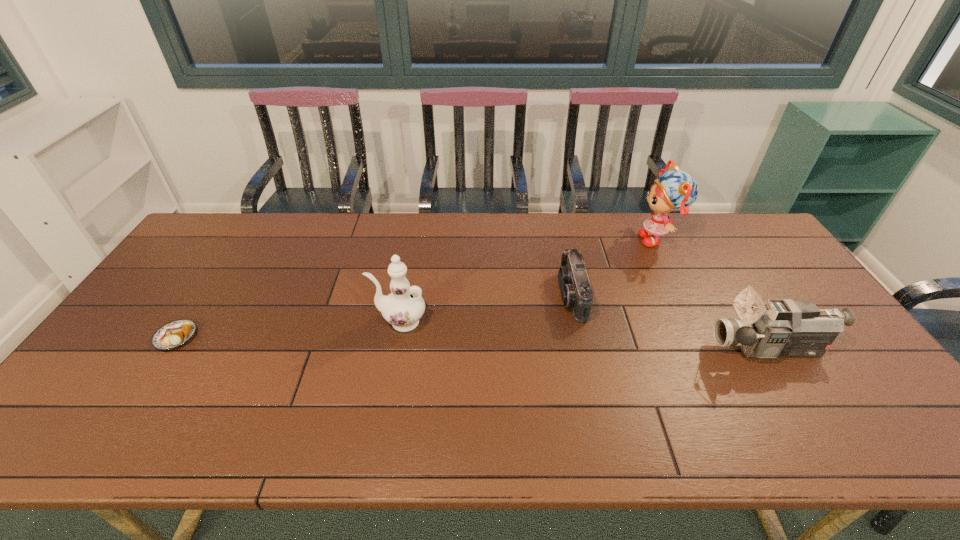
The height and width of the screenshot is (540, 960). I want to click on vacant region located on the face of the doll, so click(x=525, y=239).

Identify the location of vacant space located 0.160m at the spout of the chinaware. The image size is (960, 540). (316, 322).

The height and width of the screenshot is (540, 960). I want to click on free space located 0.080m at the spout of the chinaware, so click(x=345, y=322).

Identify the location of vacant space situated at the spout of the chinaware. This screenshot has width=960, height=540. point(326,322).

This screenshot has width=960, height=540. What are the coordinates of `vacant space located 0.060m on the front-facing side of the right camcorder` in the screenshot? It's located at (690, 349).

The image size is (960, 540). I want to click on vacant space situated 0.120m on the front-facing side of the right camcorder, so click(667, 349).

Locate an element on the screen. This screenshot has height=540, width=960. free space located 0.290m on the front-facing side of the right camcorder is located at coordinates (602, 349).

The height and width of the screenshot is (540, 960). I want to click on blank space located 0.240m on the front-facing side of the farther camcorder, so click(477, 295).

Find the location of a particular element. Image resolution: width=960 pixels, height=540 pixels. vacant space located 0.100m on the front-facing side of the farther camcorder is located at coordinates (525, 295).

Where is `blank space located on the front-facing side of the farther camcorder`? This screenshot has width=960, height=540. blank space located on the front-facing side of the farther camcorder is located at coordinates [508, 295].